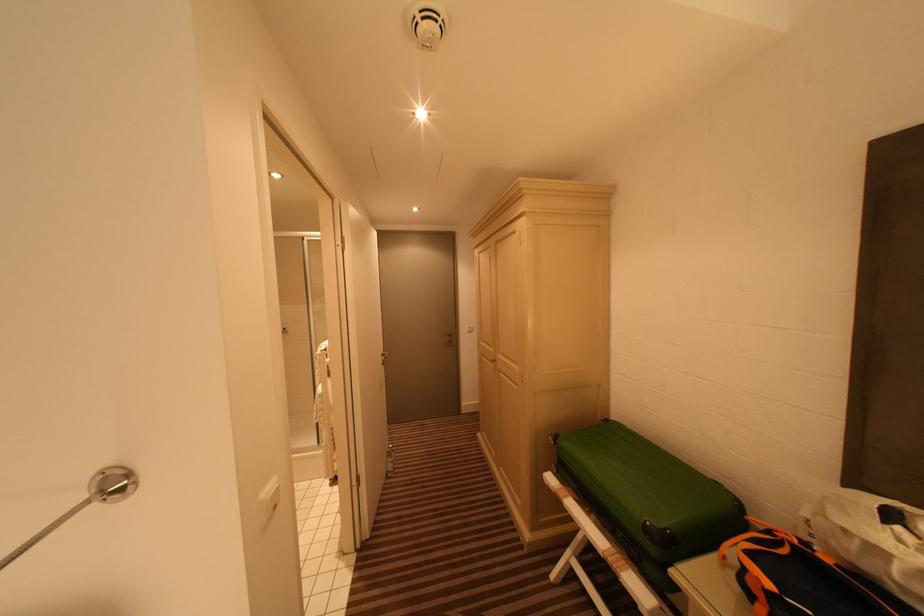
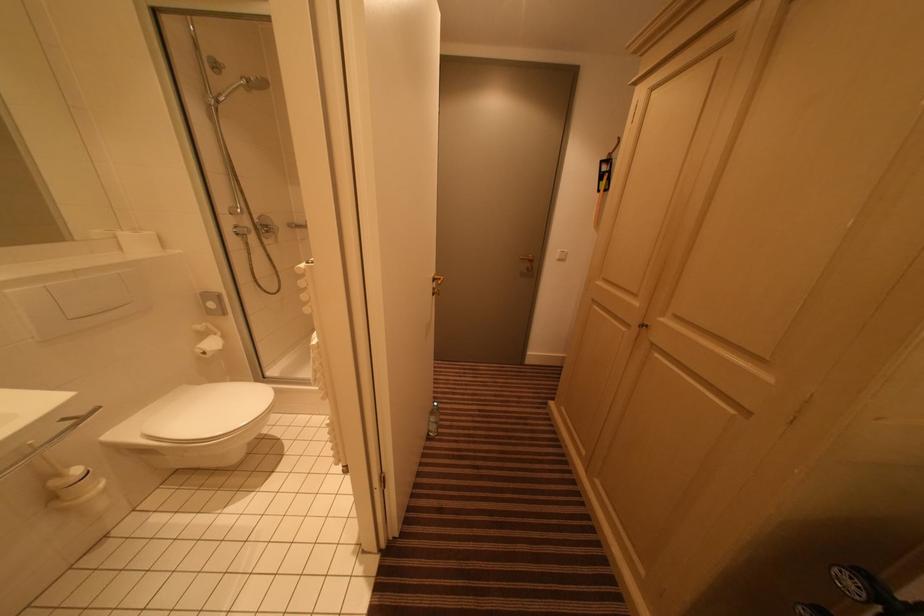
Question: What movement of the cameraman would produce the second image?

Choices:
 (A) Left
 (B) Right
 (C) Forward
 (D) Backward

Answer: (C)